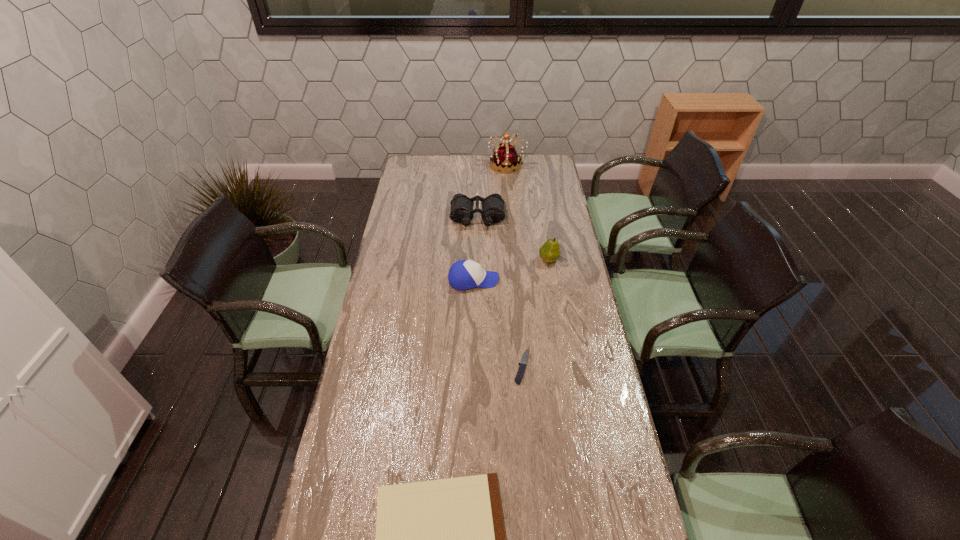
Locate an element on the screen. The image size is (960, 540). tiara is located at coordinates (506, 159).

At what (x,y) coordinates should I click in order to perform the action: click on the farthest object. Please return your answer as a coordinate pair (x, y). The width and height of the screenshot is (960, 540). Looking at the image, I should click on (506, 159).

The height and width of the screenshot is (540, 960). I want to click on pear, so click(x=550, y=252).

In order to click on the fourth nearest object in this screenshot , I will do `click(550, 252)`.

Identify the location of the fifth nearest object. (461, 211).

Find the location of a particular element. baseball cap is located at coordinates (464, 274).

Locate an element on the screen. Image resolution: width=960 pixels, height=540 pixels. the fifth farthest object is located at coordinates (520, 373).

The width and height of the screenshot is (960, 540). I want to click on the second shortest object, so click(520, 373).

Identify the location of free location located 0.200m on the front-facing side of the tiara. (452, 165).

What are the coordinates of `vacant space located on the front-facing side of the tiara` in the screenshot? It's located at (454, 165).